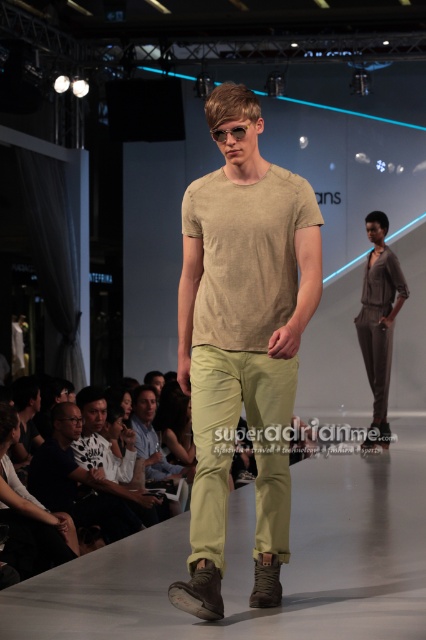
Question: Is beige cotton t-shirt at center thinner than clear plastic goggles at center?

Choices:
 (A) no
 (B) yes

Answer: (A)

Question: Is beige cotton t-shirt at center positioned in front of clear plastic goggles at center?

Choices:
 (A) no
 (B) yes

Answer: (B)

Question: Based on their relative distances, which object is nearer to the matte black shirt at center?

Choices:
 (A) clear plastic goggles at center
 (B) matte black t-shirt at center

Answer: (B)

Question: Which object is farther from the camera taking this photo?

Choices:
 (A) clear plastic goggles at center
 (B) matte gray jumpsuit at center
 (C) matte black t-shirt at center

Answer: (B)

Question: Which point is closer to the camera?

Choices:
 (A) [x=129, y=502]
 (B) [x=244, y=134]
 (C) [x=376, y=280]

Answer: (B)

Question: Does matte black shirt at center come in front of clear plastic goggles at center?

Choices:
 (A) no
 (B) yes

Answer: (A)